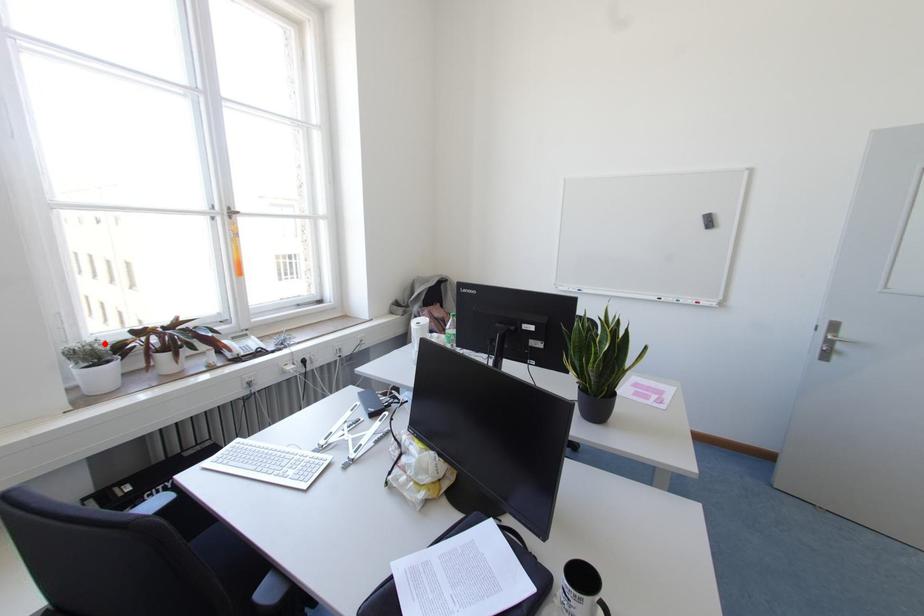
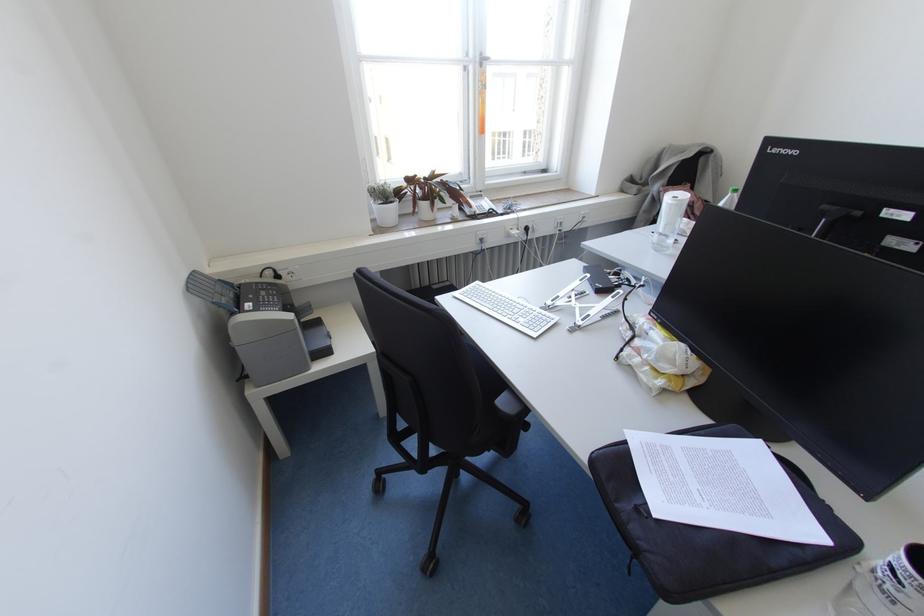
Question: I am providing you with two images of the same scene from different viewpoints. A red point is marked on the first image. Is the red point's position out of view in image 2?

Choices:
 (A) Yes
 (B) No

Answer: (B)